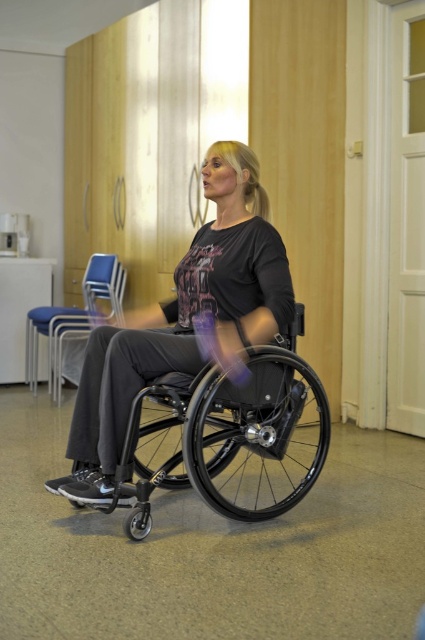
You are a physical therapist planning to move a 7.5 feet long exercise mat between the black plastic wheelchair at center and the blue fabric chair at center. Can the exercise mat fit through the space between them?

The distance between the black plastic wheelchair at center and the blue fabric chair at center is 8.45 feet, which is greater than the 7.5 feet length of the exercise mat. Therefore, the mat can fit through the space between them.

You are a physical therapist assisting a patient in a room with a matte black wheelchair at center and a blue fabric chair at center. You need to move a therapy tool from the blue fabric chair to the patient. Which object should you move the tool to?

The matte black wheelchair at center is closer to the viewer than the blue fabric chair at center, so you should move the therapy tool to the matte black wheelchair at center since it is nearer to the patient.